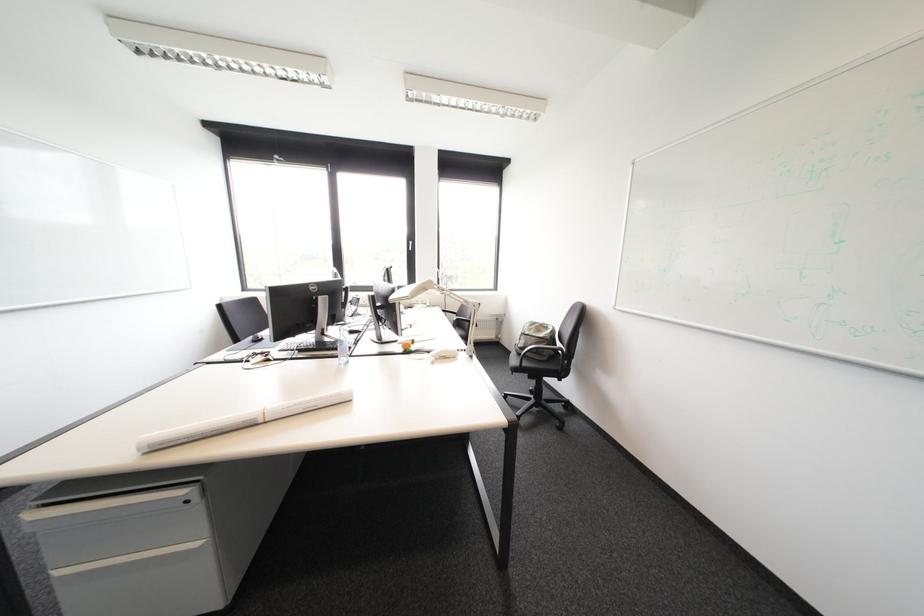
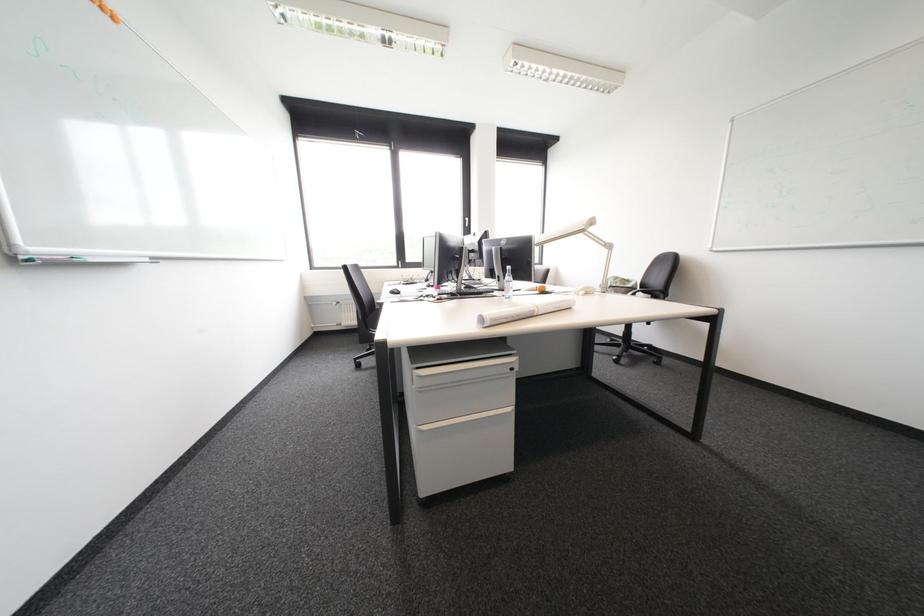
Question: What movement of the cameraman would produce the second image?

Choices:
 (A) Left
 (B) Right
 (C) Forward
 (D) Backward

Answer: (A)